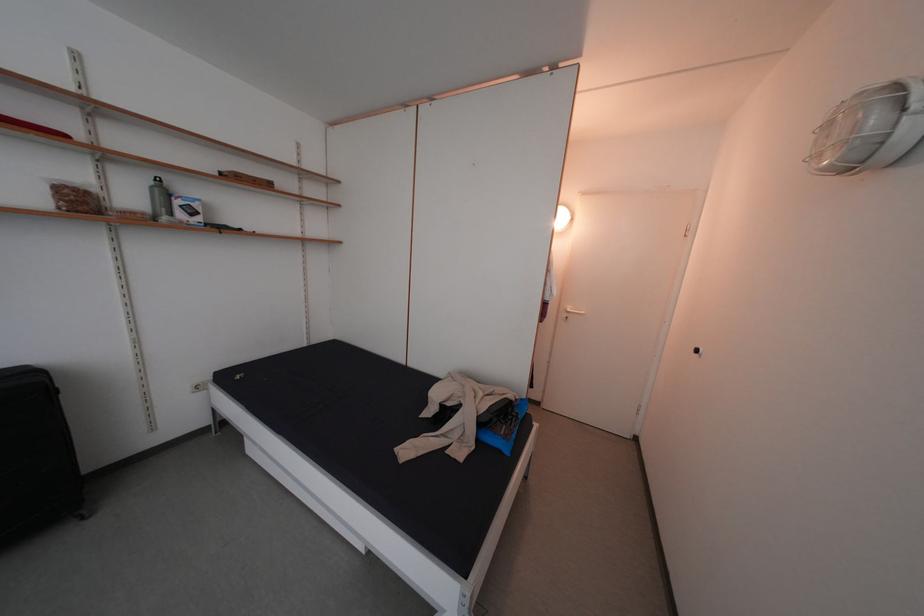
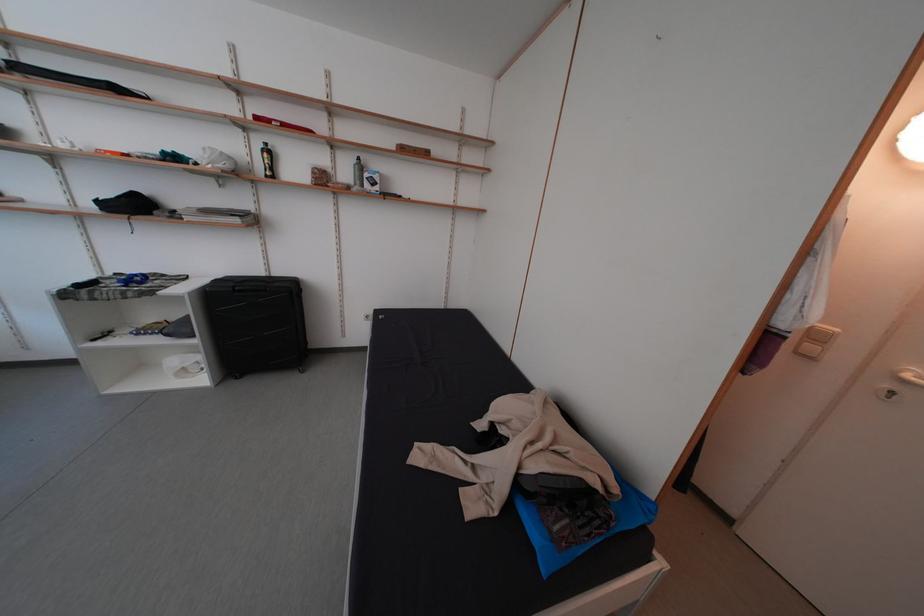
Where in the second image is the point corresponding to (578,315) from the first image?

(917, 381)